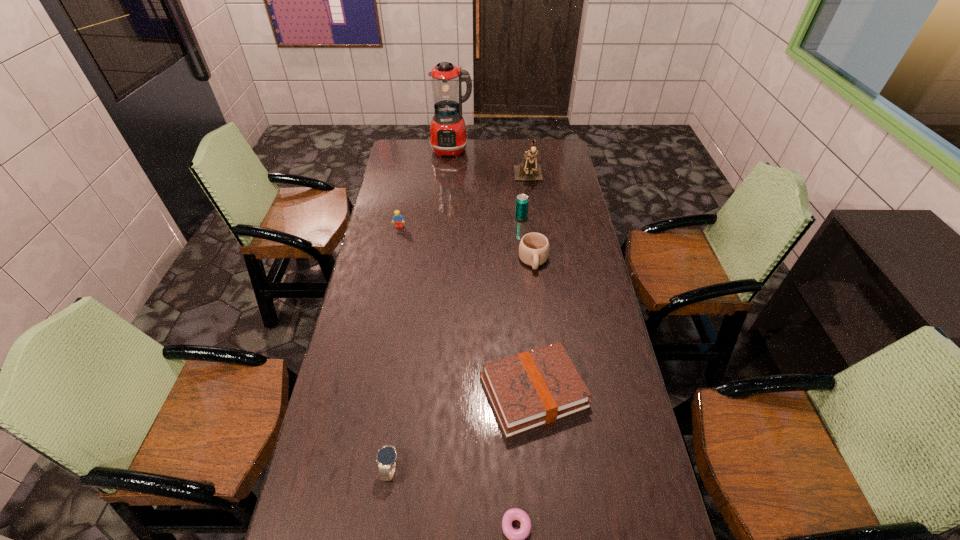
Find the location of a particular element. This screenshot has width=960, height=540. figurine that is at the right edge is located at coordinates (528, 170).

You are a GUI agent. You are given a task and a screenshot of the screen. Output one action in this format:
    pyautogui.click(x=<x>, y=<y>)
    Task: Click on the hardback book that is at the right edge
    This screenshot has width=960, height=540.
    Given the screenshot: What is the action you would take?
    pyautogui.click(x=534, y=388)

The image size is (960, 540). In the image, there is a desktop. What are the coordinates of `vacant space at the far edge` in the screenshot? It's located at (478, 157).

Find the location of `vacant space at the left edge of the desktop`. vacant space at the left edge of the desktop is located at coordinates (369, 245).

In the image, there is a desktop. At what (x,y) coordinates should I click in order to perform the action: click on vacant space at the right edge. Please return your answer as a coordinate pair (x, y). The height and width of the screenshot is (540, 960). Looking at the image, I should click on (555, 248).

You are a GUI agent. You are given a task and a screenshot of the screen. Output one action in this format:
    pyautogui.click(x=<x>, y=<y>)
    Task: Click on the empty location between the Lego and the hardback book
    This screenshot has height=540, width=960.
    Given the screenshot: What is the action you would take?
    pyautogui.click(x=467, y=309)

This screenshot has width=960, height=540. Find the location of `empty space between the sixth farthest object and the tallest object`. empty space between the sixth farthest object and the tallest object is located at coordinates (492, 271).

The width and height of the screenshot is (960, 540). Find the location of `unoccupied position between the figurine and the sixth farthest object`. unoccupied position between the figurine and the sixth farthest object is located at coordinates (531, 285).

You are a GUI agent. You are given a task and a screenshot of the screen. Output one action in this format:
    pyautogui.click(x=<x>, y=<y>)
    Task: Click on the unoccupied area between the seventh shortest object and the fourth nearest object
    This screenshot has height=540, width=960.
    Given the screenshot: What is the action you would take?
    pyautogui.click(x=531, y=220)

You are a GUI agent. You are given a task and a screenshot of the screen. Output one action in this format:
    pyautogui.click(x=<x>, y=<y>)
    Task: Click on the free point between the second tallest object and the fourth nearest object
    This screenshot has width=960, height=540.
    Given the screenshot: What is the action you would take?
    pyautogui.click(x=531, y=220)